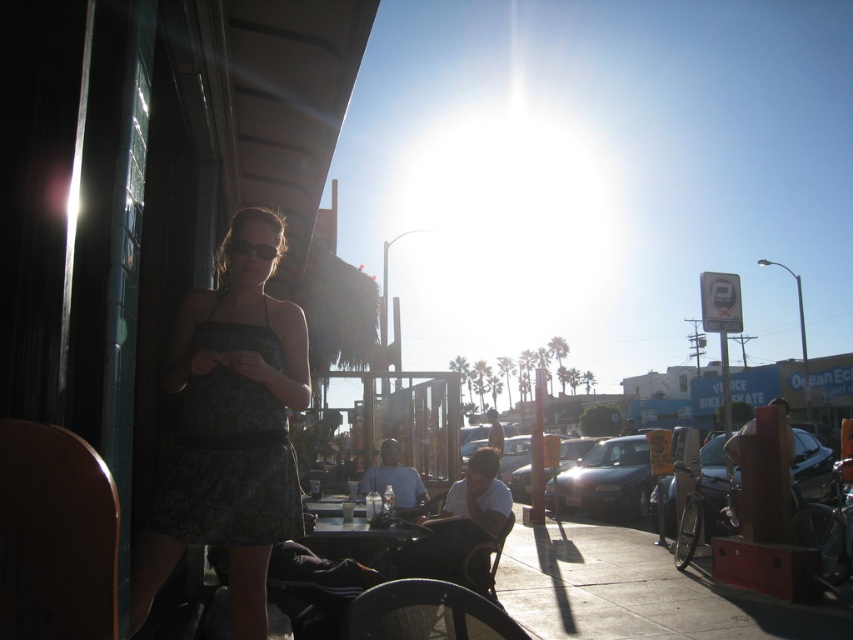
Question: Which point is farther to the camera?

Choices:
 (A) matte black dress at left
 (B) wooden table at center

Answer: (B)

Question: Does matte black dress at left appear under wooden table at center?

Choices:
 (A) no
 (B) yes

Answer: (A)

Question: Is matte black dress at left smaller than wooden table at center?

Choices:
 (A) no
 (B) yes

Answer: (A)

Question: Is matte black dress at left closer to camera compared to wooden table at center?

Choices:
 (A) no
 (B) yes

Answer: (B)